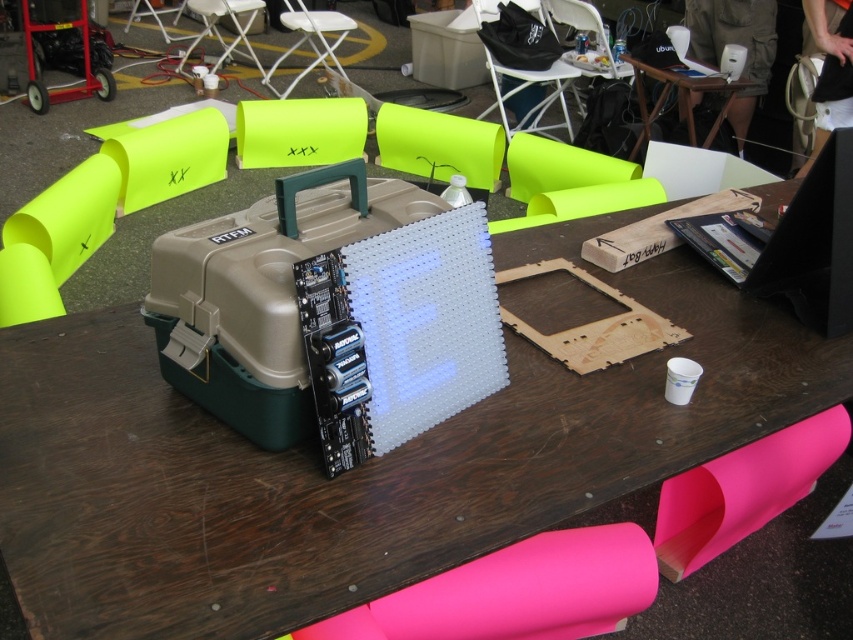
Between point (596, 228) and point (625, 60), which one is positioned behind?

Positioned behind is point (625, 60).

Can you confirm if brown wood table at center is bigger than wooden table at upper center?

Yes, brown wood table at center is bigger than wooden table at upper center.

Between point (306, 504) and point (645, 140), which one is positioned in front?

Positioned in front is point (306, 504).

Find the location of a particular element. This screenshot has width=853, height=640. brown wood table at center is located at coordinates (358, 467).